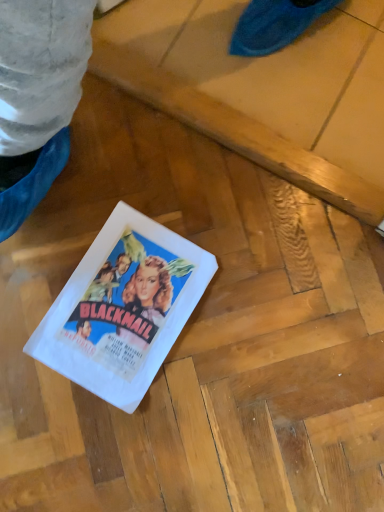
At what (x,y) coordinates should I click in order to perform the action: click on free space in front of white matte book at center. Please return your answer as a coordinate pair (x, y). Image resolution: width=384 pixels, height=512 pixels. Looking at the image, I should click on (92, 437).